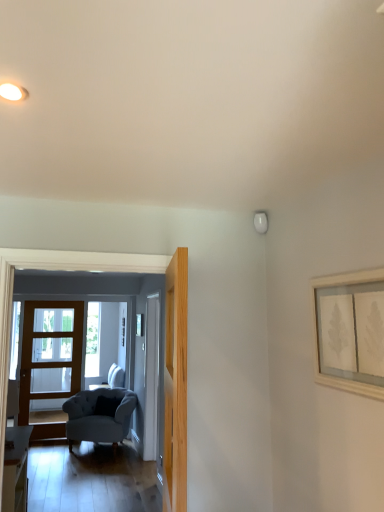
Question: Is white glossy door at center, arranged as the 2th door when viewed from the left, thinner than suede-like gray armchair at lower left?

Choices:
 (A) no
 (B) yes

Answer: (B)

Question: From the image's perspective, is white glossy door at center, which ranks as the second door in right-to-left order, beneath suede-like gray armchair at lower left?

Choices:
 (A) no
 (B) yes

Answer: (A)

Question: Is white glossy door at center, the 2th door from the front, taller than suede-like gray armchair at lower left?

Choices:
 (A) yes
 (B) no

Answer: (A)

Question: Considering the relative sizes of white glossy door at center, arranged as the 2th door when viewed from the left, and suede-like gray armchair at lower left in the image provided, is white glossy door at center, arranged as the 2th door when viewed from the left, wider than suede-like gray armchair at lower left?

Choices:
 (A) yes
 (B) no

Answer: (B)

Question: Is white glossy door at center, the second door from the back, not inside suede-like gray armchair at lower left?

Choices:
 (A) yes
 (B) no

Answer: (A)

Question: From their relative heights in the image, would you say light gray fabric armchair at left is taller or shorter than suede-like gray armchair at lower left?

Choices:
 (A) tall
 (B) short

Answer: (A)

Question: Based on their sizes in the image, would you say light gray fabric armchair at left is bigger or smaller than suede-like gray armchair at lower left?

Choices:
 (A) small
 (B) big

Answer: (A)

Question: From the image's perspective, is light gray fabric armchair at left above or below suede-like gray armchair at lower left?

Choices:
 (A) above
 (B) below

Answer: (A)

Question: Is light gray fabric armchair at left to the left or to the right of suede-like gray armchair at lower left in the image?

Choices:
 (A) right
 (B) left

Answer: (A)

Question: Based on their sizes in the image, would you say wooden framed picture at upper right is bigger or smaller than wooden glass door at left, which ranks as the 1th door in left-to-right order?

Choices:
 (A) small
 (B) big

Answer: (A)

Question: In terms of height, does wooden framed picture at upper right look taller or shorter compared to wooden glass door at left, which ranks as the first door in back-to-front order?

Choices:
 (A) short
 (B) tall

Answer: (A)

Question: Considering their positions, is wooden framed picture at upper right located in front of or behind wooden glass door at left, which ranks as the 1th door in left-to-right order?

Choices:
 (A) behind
 (B) front

Answer: (B)

Question: Is point (355, 337) closer or farther from the camera than point (81, 315)?

Choices:
 (A) farther
 (B) closer

Answer: (B)

Question: Relative to light gray fabric armchair at left, is light wood door at center, arranged as the 3th door when viewed from the back, in front or behind?

Choices:
 (A) behind
 (B) front

Answer: (B)

Question: From the image's perspective, is light wood door at center, arranged as the 3th door when viewed from the left, above or below light gray fabric armchair at left?

Choices:
 (A) below
 (B) above

Answer: (B)